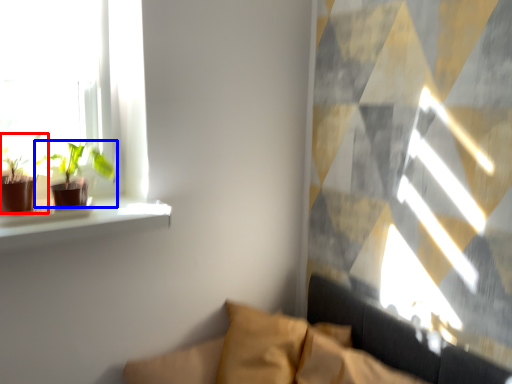
Question: Which of the following is the closest to the observer, houseplant (highlighted by a red box) or houseplant (highlighted by a blue box)?

Choices:
 (A) houseplant
 (B) houseplant

Answer: (A)